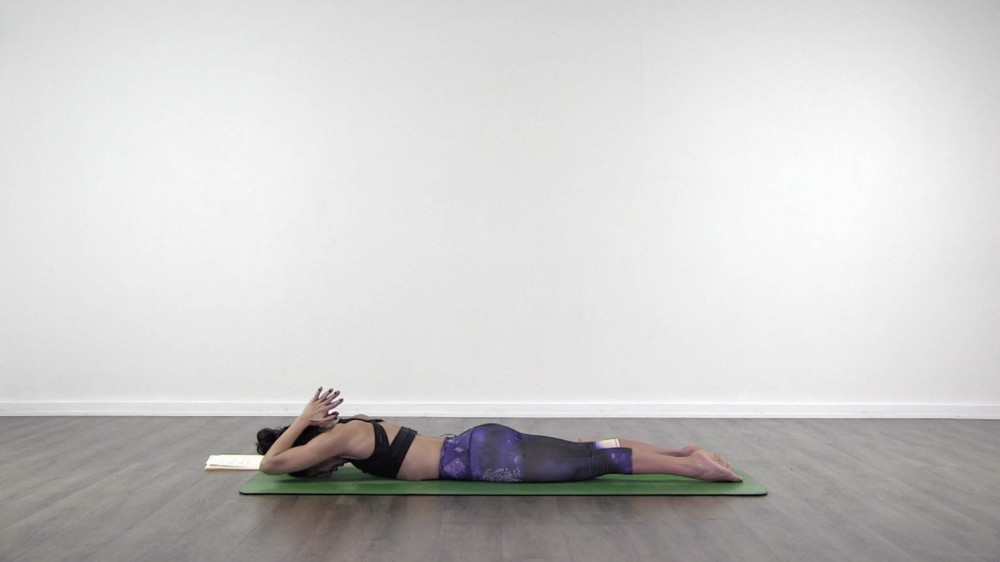
Locate an element on the screen. trim is located at coordinates (126, 407).